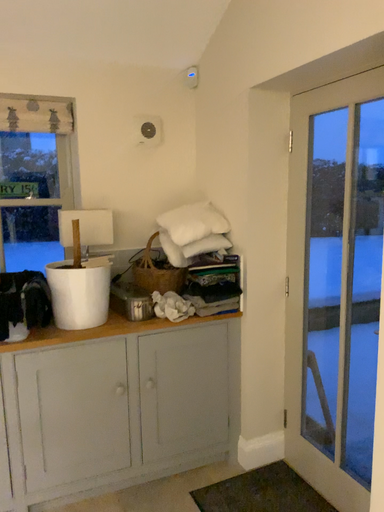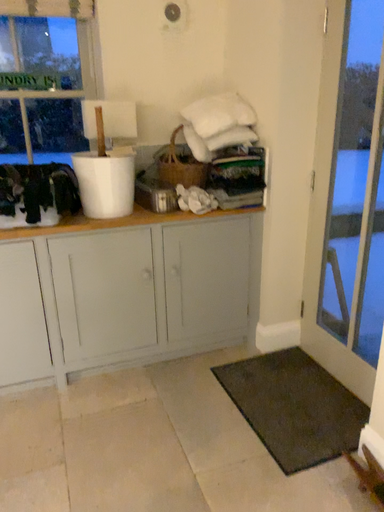
Question: How did the camera likely rotate when shooting the video?

Choices:
 (A) rotated downward
 (B) rotated upward

Answer: (A)